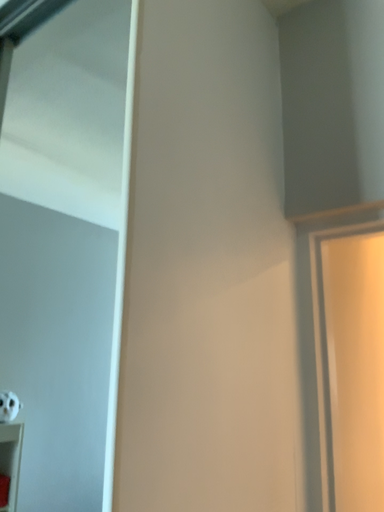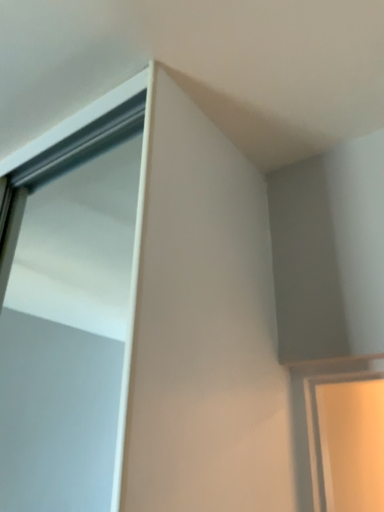
Question: How did the camera likely rotate when shooting the video?

Choices:
 (A) rotated downward
 (B) rotated upward

Answer: (B)